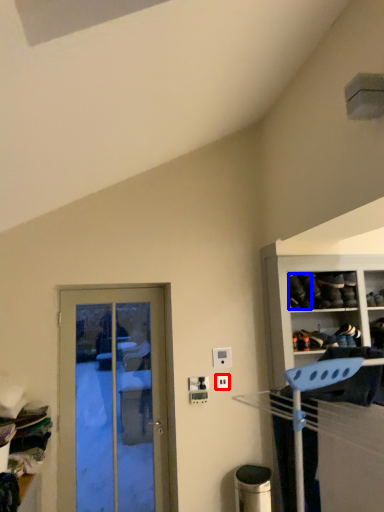
Question: Among these objects, which one is farthest to the camera, electric outlet (highlighted by a red box) or shoe (highlighted by a blue box)?

Choices:
 (A) electric outlet
 (B) shoe

Answer: (A)